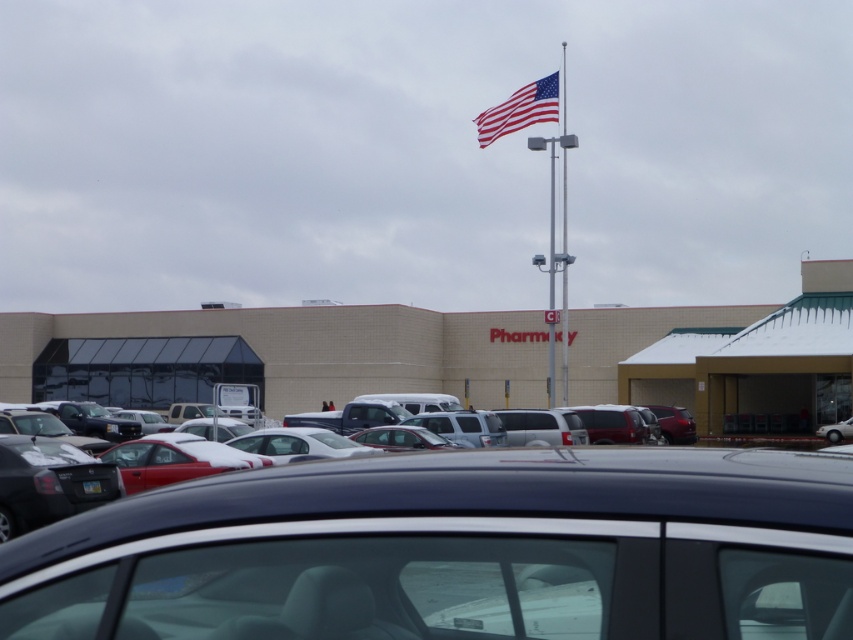
Question: Which of the following is the closest to the observer?

Choices:
 (A) (531, 108)
 (B) (132, 596)
 (C) (332, 365)
 (D) (566, 296)

Answer: (B)

Question: Does shiny black sedan at center lie behind metallic silver flag pole at upper center?

Choices:
 (A) no
 (B) yes

Answer: (A)

Question: Considering the real-world distances, which object is farthest from the metallic silver flag pole at upper center?

Choices:
 (A) american flag at upper center
 (B) beige brick building at center

Answer: (B)

Question: Does shiny black sedan at center have a lesser width compared to beige brick building at center?

Choices:
 (A) yes
 (B) no

Answer: (A)

Question: Which of the following is the farthest from the observer?

Choices:
 (A) (691, 516)
 (B) (566, 374)

Answer: (B)

Question: Does beige brick building at center have a larger size compared to american flag at upper center?

Choices:
 (A) yes
 (B) no

Answer: (B)